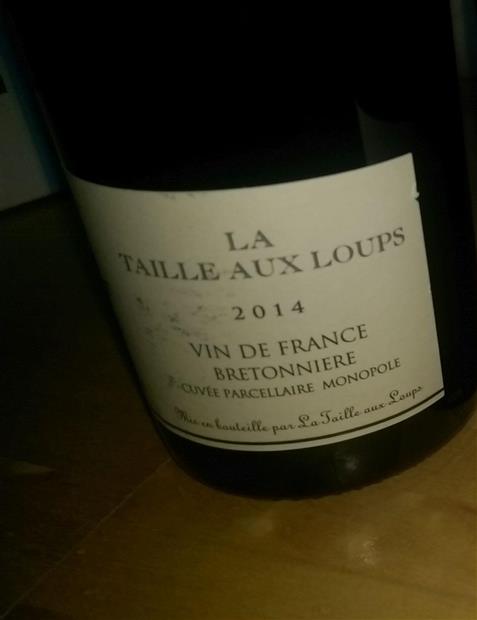
Identify the location of wine bottle under label. [x=288, y=462].